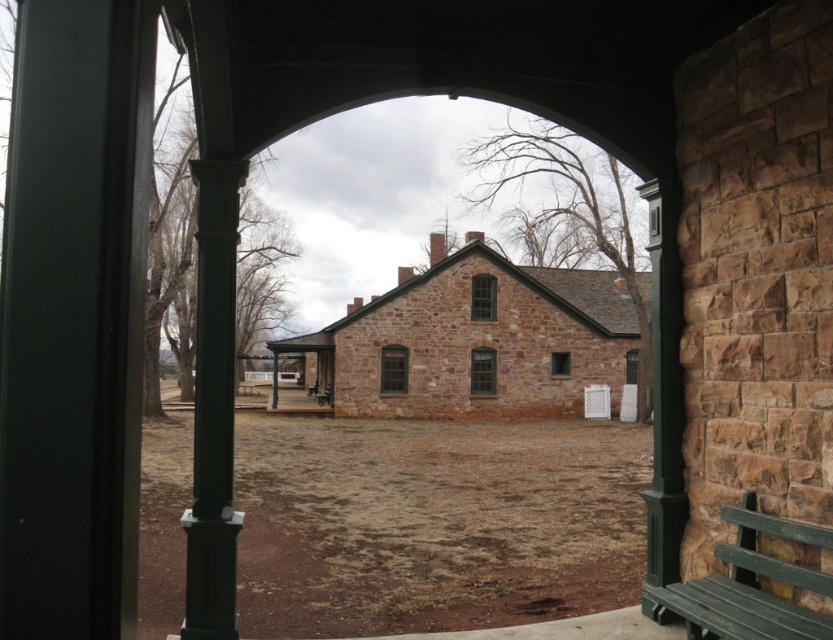
Question: Which point appears closest to the camera in this image?

Choices:
 (A) (756, 605)
 (B) (190, 531)
 (C) (322, 516)

Answer: (A)

Question: Among these objects, which one is farthest from the camera?

Choices:
 (A) green painted wood post at left
 (B) green wood bench at lower right

Answer: (A)

Question: Is brown dirt field at center to the left of green painted wood post at left from the viewer's perspective?

Choices:
 (A) yes
 (B) no

Answer: (B)

Question: Which point is closer to the camera?

Choices:
 (A) (767, 518)
 (B) (203, 202)
 (C) (363, 572)

Answer: (A)

Question: Is brown dirt field at center wider than green wood bench at lower right?

Choices:
 (A) no
 (B) yes

Answer: (B)

Question: Can you confirm if brown dirt field at center is thinner than green painted wood post at left?

Choices:
 (A) yes
 (B) no

Answer: (B)